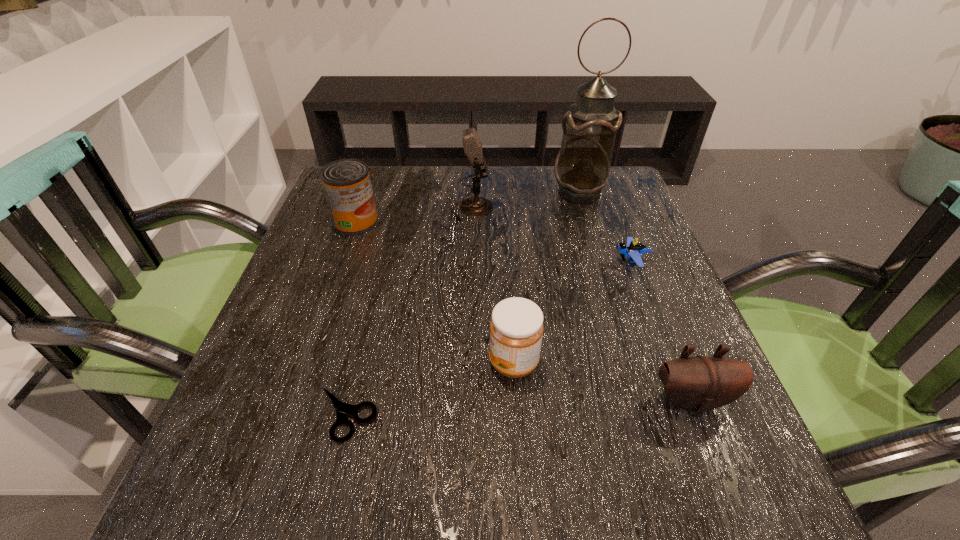
Locate an element on the screen. The width and height of the screenshot is (960, 540). empty space between the shortest object and the pouch is located at coordinates (x=518, y=407).

Locate an element on the screen. blank region between the pouch and the jam is located at coordinates (603, 382).

You are a GUI agent. You are given a task and a screenshot of the screen. Output one action in this format:
    pyautogui.click(x=<x>, y=<y>)
    Task: Click on the object that is the fourth closest to the oil lamp
    This screenshot has height=540, width=960.
    Given the screenshot: What is the action you would take?
    pyautogui.click(x=516, y=328)

The width and height of the screenshot is (960, 540). In order to click on the fourth closest object relative to the can in this screenshot , I will do `click(582, 168)`.

The width and height of the screenshot is (960, 540). I want to click on vacant region that satisfies the following two spatial constraints: 1. on the back side of the can; 2. on the right side of the tallest object, so click(366, 192).